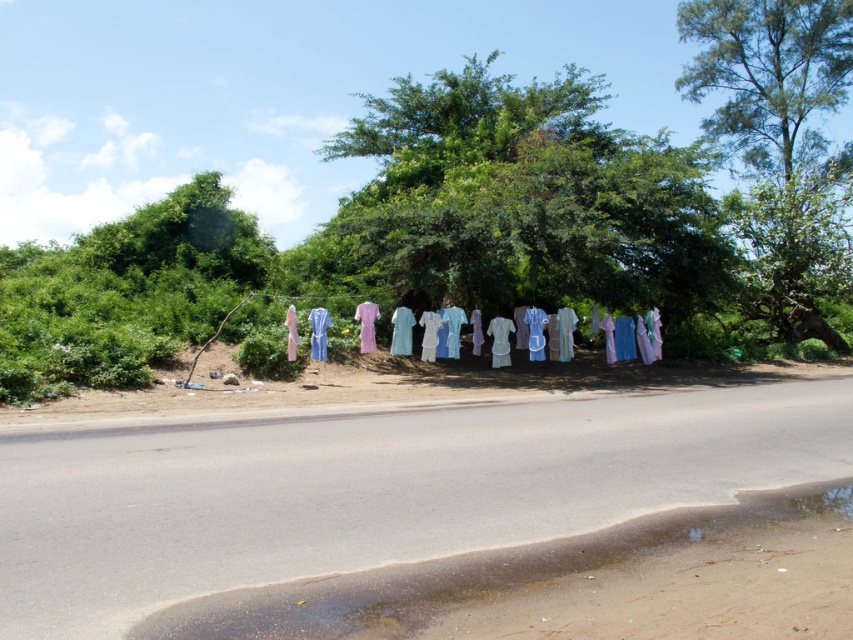
You are a hiker carrying a heavy backpack and need to cross the brown wet asphalt at lower center to reach the green leafy tree at center. The distance between them is 38.69 meters. If your backpack weighs 15 kilograms and you can walk at a speed of 1.5 meters per second, how long will it take you to reach the tree?

The distance between the green leafy tree at center and brown wet asphalt at lower center is 38.69 meters. At a walking speed of 1.5 meters per second, it would take approximately 25.8 seconds to reach the tree.

You are a hiker who wants to take a photo of both the green leafy tree at center and the green leafy tree at upper right. Which tree should you stand closer to in order to capture both in a single frame?

You should stand closer to the green leafy tree at upper right because it is smaller than the green leafy tree at center. By positioning yourself closer to the smaller tree, you can include both trees within the camera frame more effectively.

You are a pedestrian walking along the road and see the brown wet asphalt at lower center and the green leafy tree at upper right. Which object is positioned to the left of the other?

The brown wet asphalt at lower center is to the left of the green leafy tree at upper right.